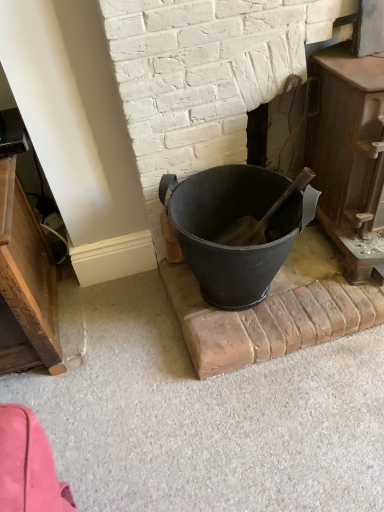
What is the approximate height of matte black bucket at center?

It is 14.51 inches.

Describe the element at coordinates (237, 227) in the screenshot. I see `matte black bucket at center` at that location.

You are a GUI agent. You are given a task and a screenshot of the screen. Output one action in this format:
    pyautogui.click(x=<x>, y=<y>)
    Task: Click on the matte black bucket at center
    The height and width of the screenshot is (512, 384).
    Given the screenshot: What is the action you would take?
    pyautogui.click(x=237, y=227)

Image resolution: width=384 pixels, height=512 pixels. Find the location of `rustic wood stove at right`. rustic wood stove at right is located at coordinates (348, 153).

Measure the distance between rustic wood stove at right and camera.

37.81 inches.

This screenshot has height=512, width=384. Describe the element at coordinates (348, 153) in the screenshot. I see `rustic wood stove at right` at that location.

Locate an element on the screen. Image resolution: width=384 pixels, height=512 pixels. matte black bucket at center is located at coordinates (237, 227).

Is matte black bucket at center to the left or to the right of rustic wood stove at right in the image?

→ Clearly, matte black bucket at center is on the left of rustic wood stove at right in the image.

Is the depth of matte black bucket at center greater than that of rustic wood stove at right?

Yes, matte black bucket at center is further from the camera.

Is point (207, 298) more distant than point (372, 156)?

Yes, it is.

From the image's perspective, which is above, matte black bucket at center or rustic wood stove at right?

rustic wood stove at right is shown above in the image.

From a real-world perspective, is matte black bucket at center physically above rustic wood stove at right?

No, from a real-world perspective, matte black bucket at center is not over rustic wood stove at right

Consider the image. Does matte black bucket at center have a lesser width compared to rustic wood stove at right?

Correct, the width of matte black bucket at center is less than that of rustic wood stove at right.

Who is shorter, matte black bucket at center or rustic wood stove at right?

With less height is matte black bucket at center.

Which of these two, matte black bucket at center or rustic wood stove at right, is bigger?

A: With larger size is rustic wood stove at right.

Is rustic wood stove at right completely or partially inside matte black bucket at center?

No, rustic wood stove at right is located outside of matte black bucket at center.

Is the surface of matte black bucket at center in direct contact with rustic wood stove at right?

No, matte black bucket at center is not touching rustic wood stove at right.

Is matte black bucket at center aimed at rustic wood stove at right?

No, matte black bucket at center is not facing towards rustic wood stove at right.

Find the location of `fireplace that appears above the matte black bucket at center (from the image's perspective)`. fireplace that appears above the matte black bucket at center (from the image's perspective) is located at coordinates (348, 153).

Which object is positioned more to the left, rustic wood stove at right or matte black bucket at center?

From the viewer's perspective, matte black bucket at center appears more on the left side.

Relative to matte black bucket at center, is rustic wood stove at right in front or behind?

rustic wood stove at right is in front of matte black bucket at center.

Does point (330, 58) come in front of point (288, 191)?

No, it is not.

From the image's perspective, is rustic wood stove at right over matte black bucket at center?

Yes, from the image's perspective, rustic wood stove at right is above matte black bucket at center.

From a real-world perspective, who is located lower, rustic wood stove at right or matte black bucket at center?

matte black bucket at center is physically lower.

Between rustic wood stove at right and matte black bucket at center, which one has larger width?

Wider between the two is rustic wood stove at right.

Is rustic wood stove at right shorter than matte black bucket at center?

Incorrect, the height of rustic wood stove at right does not fall short of that of matte black bucket at center.

Does rustic wood stove at right have a smaller size compared to matte black bucket at center?

No, rustic wood stove at right is not smaller than matte black bucket at center.

From the picture: Is rustic wood stove at right surrounding matte black bucket at center?

No, matte black bucket at center is not a part of rustic wood stove at right.

Are rustic wood stove at right and matte black bucket at center making contact?

rustic wood stove at right is not next to matte black bucket at center, and they're not touching.

Is rustic wood stove at right looking in the opposite direction of matte black bucket at center?

No.

The width and height of the screenshot is (384, 512). I want to click on fireplace positioned vertically above the matte black bucket at center (from a real-world perspective), so click(348, 153).

Find the location of a particular element. fireplace that appears above the matte black bucket at center (from the image's perspective) is located at coordinates click(348, 153).

Locate an element on the screen. Image resolution: width=384 pixels, height=512 pixels. bucket below the rustic wood stove at right (from a real-world perspective) is located at coordinates (237, 227).